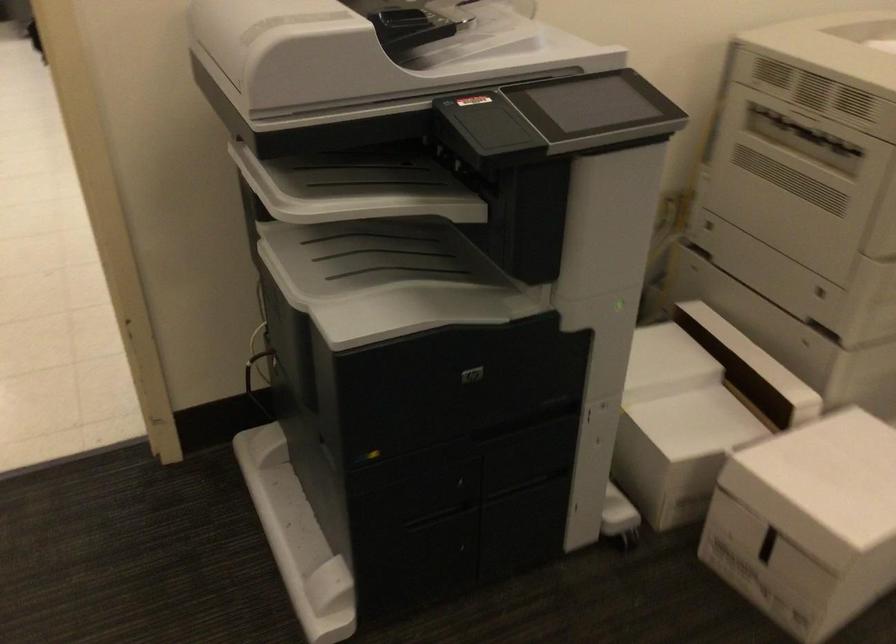
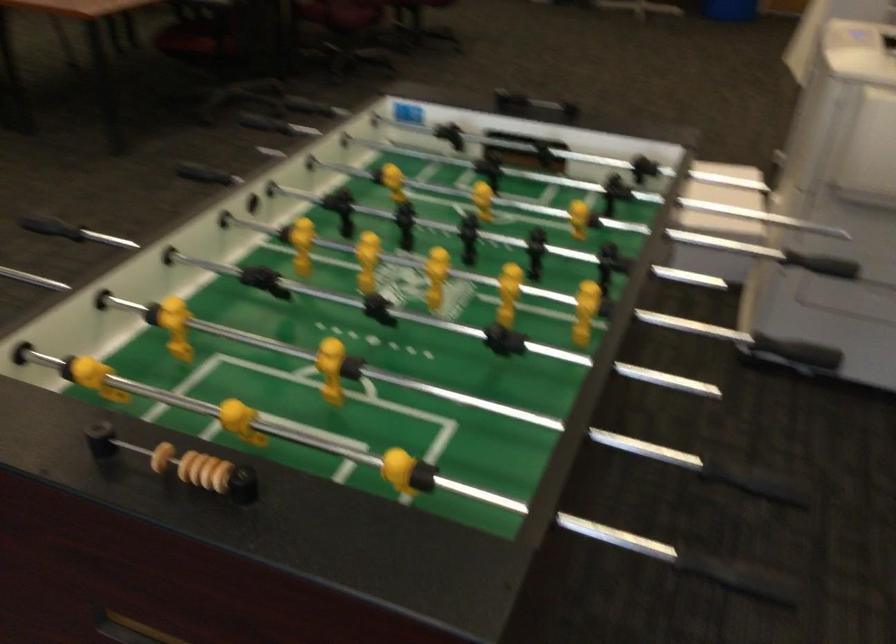
Question: I am providing you with two images of the same scene from different viewpoints. Which of the following objects are not visible in image2?

Choices:
 (A) black rod handle
 (B) metal loop handle
 (C) wooden scoring bead
 (D) white box lid

Answer: (D)